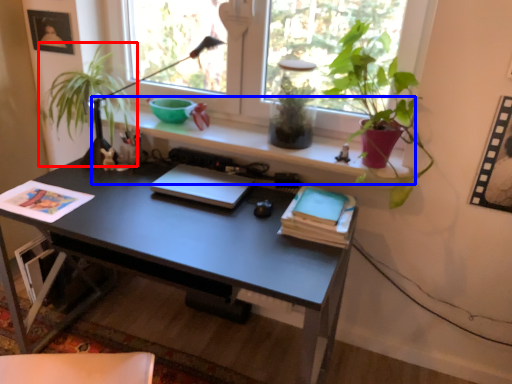
Question: Which object is further to the camera taking this photo, plant (highlighted by a red box) or window sill (highlighted by a blue box)?

Choices:
 (A) plant
 (B) window sill

Answer: (A)